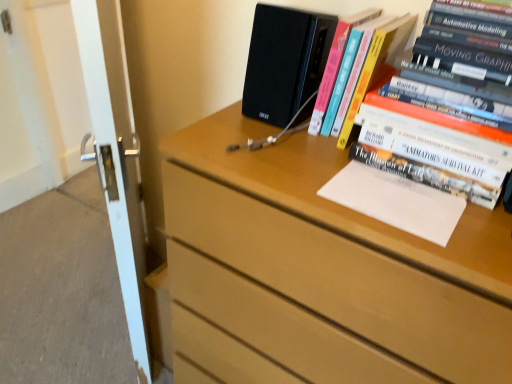
Question: From their relative heights in the image, would you say hardcover books at upper right, which is the 1th book in right-to-left order, is taller or shorter than hardcover book at upper right, which appears as the second book when viewed from the right?

Choices:
 (A) tall
 (B) short

Answer: (A)

Question: From a real-world perspective, is hardcover books at upper right, positioned as the 2th book in left-to-right order, above or below hardcover book at upper right, which appears as the second book when viewed from the right?

Choices:
 (A) above
 (B) below

Answer: (A)

Question: Based on their relative distances, which object is nearer to the white paper at upper right?

Choices:
 (A) hardcover book at upper right, which appears as the second book when viewed from the right
 (B) hardcover books at upper right, which is the 1th book in right-to-left order
 (C) white glossy screen door at left
 (D) wooden chest of drawers at upper right

Answer: (B)

Question: Based on their relative distances, which object is nearer to the hardcover book at upper right, the first book in the left-to-right sequence?

Choices:
 (A) wooden chest of drawers at upper right
 (B) hardcover books at upper right, which is the 1th book in right-to-left order
 (C) white paper at upper right
 (D) white glossy screen door at left

Answer: (B)